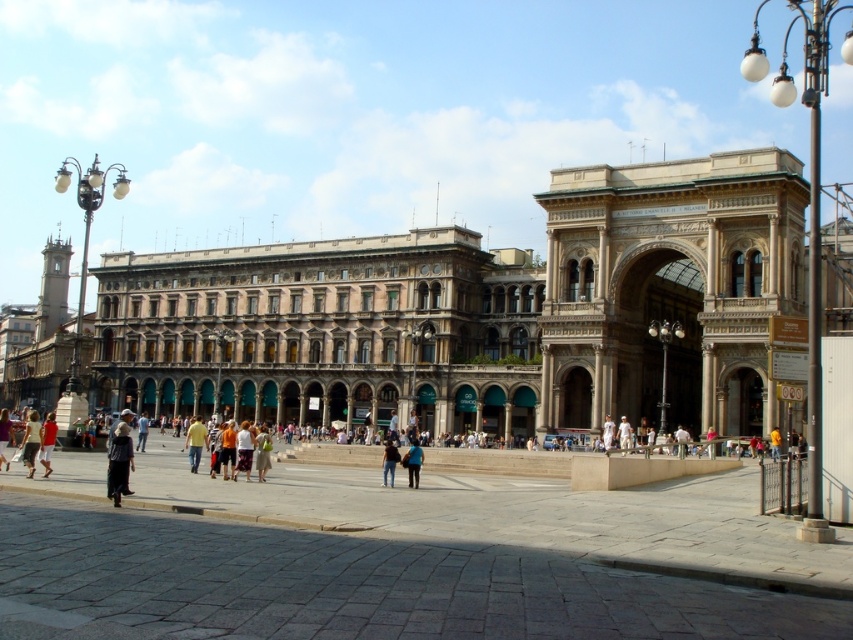
Question: Which point is farther to the camera?

Choices:
 (A) blue fabric jacket at center
 (B) brown stone building at center
 (C) yellow cotton shirt at center

Answer: (B)

Question: Is the position of white cotton dress at center more distant than that of matte red shirt at lower left?

Choices:
 (A) yes
 (B) no

Answer: (B)

Question: Which point is farther from the camera taking this photo?

Choices:
 (A) coord(108,483)
 (B) coord(202,444)
 (C) coord(22,438)
 (D) coord(416,449)

Answer: (C)

Question: Is dark gray fabric jacket at lower left thinner than blue fabric jacket at center?

Choices:
 (A) no
 (B) yes

Answer: (A)

Question: Where is dark gray fabric jacket at lower left located in relation to yellow fabric person at center in the image?

Choices:
 (A) below
 (B) above

Answer: (A)

Question: Among these points, which one is nearest to the camera?

Choices:
 (A) (200, 435)
 (B) (415, 451)
 (C) (45, 456)

Answer: (C)